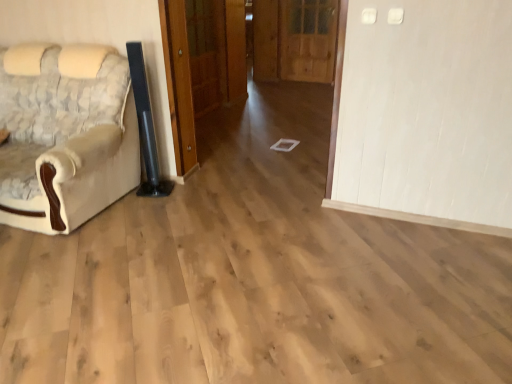
Question: Can you confirm if wooden door at center, the second door from the right, is shorter than beige fabric chair at left?

Choices:
 (A) no
 (B) yes

Answer: (A)

Question: Does wooden door at center, which is counted as the second door, starting from the left, have a smaller size compared to beige fabric chair at left?

Choices:
 (A) no
 (B) yes

Answer: (B)

Question: Is wooden door at center, which is counted as the second door, starting from the left, further to camera compared to beige fabric chair at left?

Choices:
 (A) yes
 (B) no

Answer: (A)

Question: Is beige fabric chair at left inside wooden door at center, which is counted as the second door, starting from the left?

Choices:
 (A) yes
 (B) no

Answer: (B)

Question: Is wooden door at center, the second door from the right, to the left of beige fabric chair at left from the viewer's perspective?

Choices:
 (A) no
 (B) yes

Answer: (A)

Question: Can you confirm if wooden door at center, the second door from the right, is thinner than beige fabric chair at left?

Choices:
 (A) no
 (B) yes

Answer: (B)

Question: Is wooden door at center, placed as the 1th door when sorted from left to right, at the right side of wooden door at center, which is the third door in left-to-right order?

Choices:
 (A) yes
 (B) no

Answer: (B)

Question: From a real-world perspective, is wooden door at center, which is the 3th door from right to left, under wooden door at center, the first door in the right-to-left sequence?

Choices:
 (A) no
 (B) yes

Answer: (A)

Question: Is wooden door at center, which is the 3th door from right to left, at the left side of wooden door at center, which is the third door in left-to-right order?

Choices:
 (A) no
 (B) yes

Answer: (B)

Question: Is wooden door at center, the first door in the right-to-left sequence, surrounded by wooden door at center, placed as the 1th door when sorted from left to right?

Choices:
 (A) yes
 (B) no

Answer: (B)

Question: Considering the relative sizes of wooden door at center, which is the 3th door from right to left, and wooden door at center, which is the third door in left-to-right order, in the image provided, is wooden door at center, which is the 3th door from right to left, bigger than wooden door at center, which is the third door in left-to-right order,?

Choices:
 (A) yes
 (B) no

Answer: (B)

Question: From the image's perspective, is wooden door at center, which is the 3th door from right to left, under wooden door at center, which is the third door in left-to-right order?

Choices:
 (A) no
 (B) yes

Answer: (B)

Question: Considering the relative positions of wooden door at center, which is the third door in left-to-right order, and wooden door at center, which is the 3th door from right to left, in the image provided, is wooden door at center, which is the third door in left-to-right order, to the right of wooden door at center, which is the 3th door from right to left, from the viewer's perspective?

Choices:
 (A) no
 (B) yes

Answer: (B)